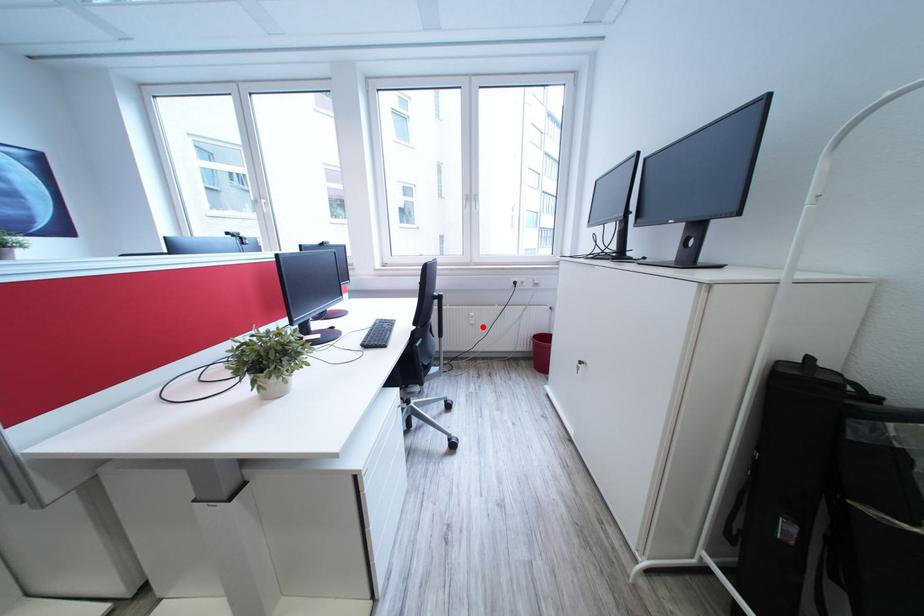
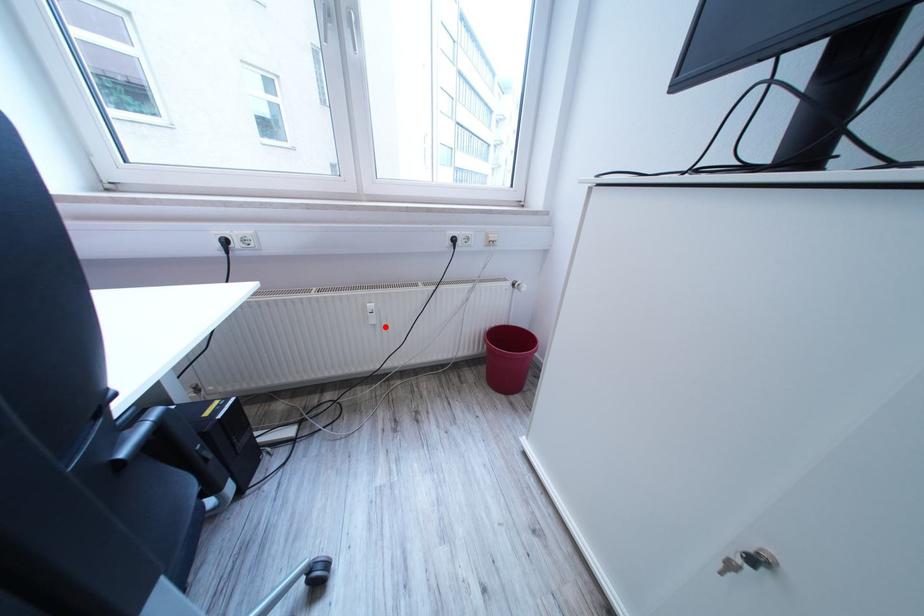
I am providing you with two images of the same scene from different viewpoints. A red point is marked on the first image and another point is marked on the second image. Is the red point in image1 aligned with the point shown in image2?

Yes